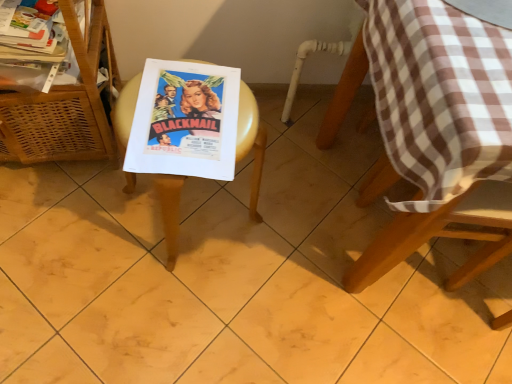
You are a GUI agent. You are given a task and a screenshot of the screen. Output one action in this format:
    pyautogui.click(x=<x>, y=<y>)
    Task: Click on the vacant space situated above matte paper poster at center (from a real-world perspective)
    The image size is (512, 384).
    Given the screenshot: What is the action you would take?
    pyautogui.click(x=186, y=102)